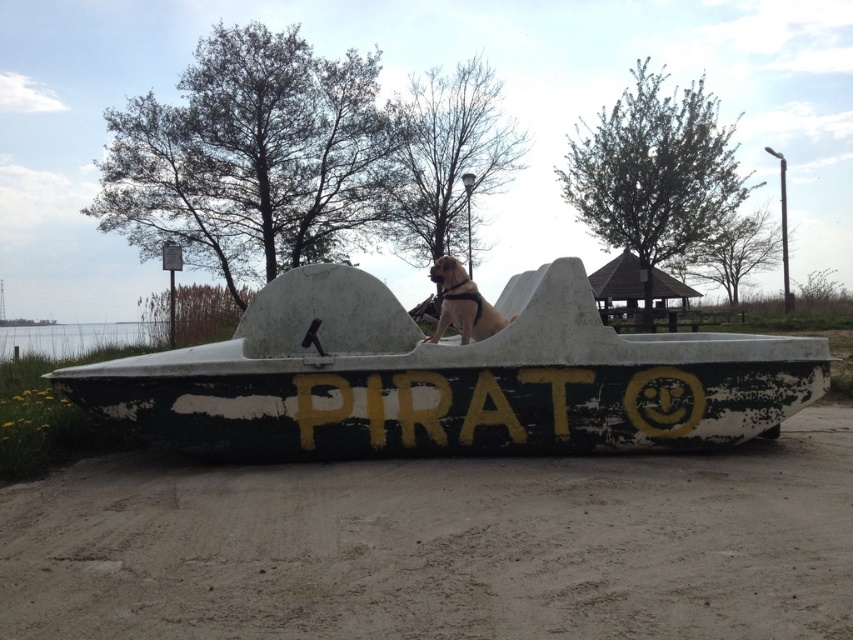
Question: Which object appears farthest from the camera in this image?

Choices:
 (A) green weathered boat at center
 (B) golden fur dog at center
 (C) brown textured dirt track at center

Answer: (B)

Question: Is brown textured dirt track at center bigger than green weathered boat at center?

Choices:
 (A) yes
 (B) no

Answer: (B)

Question: Estimate the real-world distances between objects in this image. Which object is closer to the green weathered boat at center?

Choices:
 (A) golden fur dog at center
 (B) brown textured dirt track at center

Answer: (A)

Question: Is brown textured dirt track at center closer to camera compared to green weathered boat at center?

Choices:
 (A) yes
 (B) no

Answer: (A)

Question: Can you confirm if brown textured dirt track at center is positioned above green weathered boat at center?

Choices:
 (A) yes
 (B) no

Answer: (B)

Question: Which object appears farthest from the camera in this image?

Choices:
 (A) golden fur dog at center
 (B) green weathered boat at center

Answer: (A)